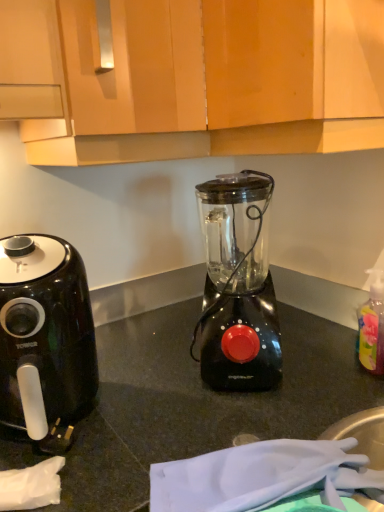
Question: Is black plastic blender at center taller or shorter than wooden cabinet at upper center?

Choices:
 (A) short
 (B) tall

Answer: (A)

Question: Is point (271, 346) closer or farther from the camera than point (322, 16)?

Choices:
 (A) farther
 (B) closer

Answer: (A)

Question: Which is nearer to the translucent plastic bottle at right?

Choices:
 (A) black plastic air fryer at left
 (B) black plastic blender at center
 (C) wooden cabinet at upper center

Answer: (B)

Question: Which is farther from the wooden cabinet at upper center?

Choices:
 (A) black plastic air fryer at left
 (B) black plastic blender at center
 (C) translucent plastic bottle at right

Answer: (C)